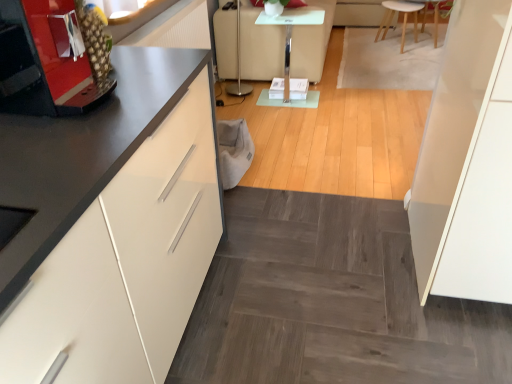
Question: Is the position of metallic red coffee machine at left less distant than that of light wood stool at upper right?

Choices:
 (A) no
 (B) yes

Answer: (B)

Question: Is light wood stool at upper right a part of metallic red coffee machine at left?

Choices:
 (A) no
 (B) yes

Answer: (A)

Question: Could you tell me if metallic red coffee machine at left is facing light wood stool at upper right?

Choices:
 (A) no
 (B) yes

Answer: (A)

Question: Is metallic red coffee machine at left bigger than light wood stool at upper right?

Choices:
 (A) no
 (B) yes

Answer: (A)

Question: Considering the relative sizes of metallic red coffee machine at left and light wood stool at upper right in the image provided, is metallic red coffee machine at left wider than light wood stool at upper right?

Choices:
 (A) no
 (B) yes

Answer: (A)

Question: Would you say clear glass table at center is to the left or to the right of white leather couch at center in the picture?

Choices:
 (A) left
 (B) right

Answer: (A)

Question: Considering their positions, is clear glass table at center located in front of or behind white leather couch at center?

Choices:
 (A) behind
 (B) front

Answer: (B)

Question: Looking at the image, does clear glass table at center seem bigger or smaller compared to white leather couch at center?

Choices:
 (A) small
 (B) big

Answer: (A)

Question: In terms of width, does clear glass table at center look wider or thinner when compared to white leather couch at center?

Choices:
 (A) wide
 (B) thin

Answer: (B)

Question: From the image's perspective, is white leather couch at center located above or below clear glass table at center?

Choices:
 (A) below
 (B) above

Answer: (B)

Question: Based on their sizes in the image, would you say white leather couch at center is bigger or smaller than clear glass table at center?

Choices:
 (A) small
 (B) big

Answer: (B)

Question: Looking at their shapes, would you say white leather couch at center is wider or thinner than clear glass table at center?

Choices:
 (A) wide
 (B) thin

Answer: (A)

Question: From their relative heights in the image, would you say white leather couch at center is taller or shorter than clear glass table at center?

Choices:
 (A) short
 (B) tall

Answer: (B)

Question: In terms of width, does metallic red coffee machine at left look wider or thinner when compared to clear glass table at center?

Choices:
 (A) thin
 (B) wide

Answer: (A)

Question: From a real-world perspective, is metallic red coffee machine at left above or below clear glass table at center?

Choices:
 (A) above
 (B) below

Answer: (A)